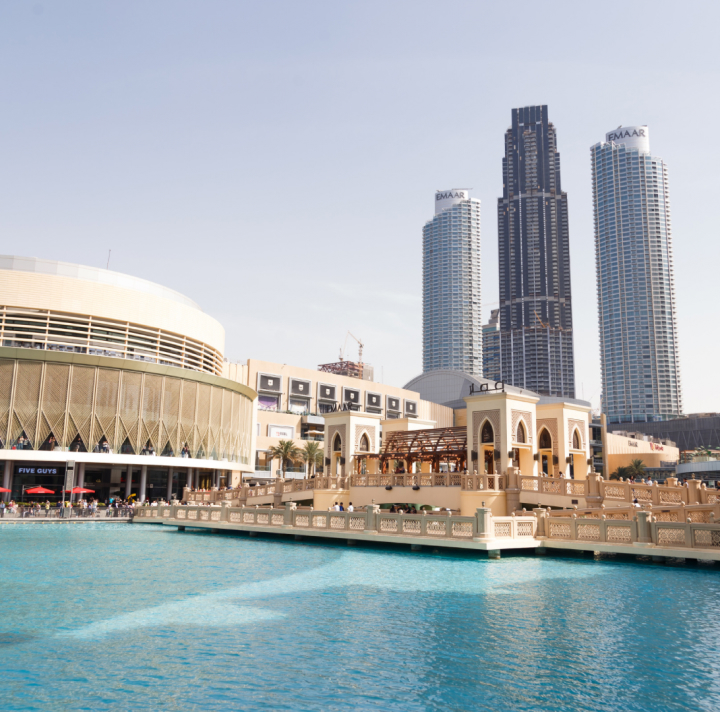
Locate an element on the screen. windows is located at coordinates (577, 436), (544, 438), (522, 436), (490, 434).